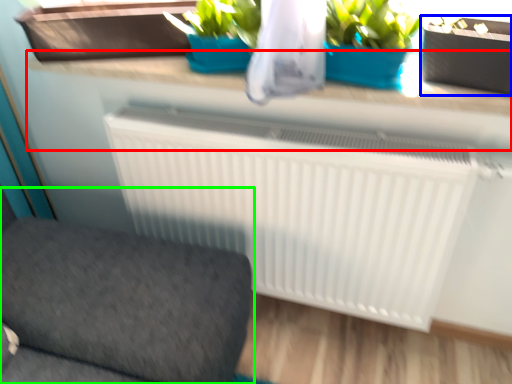
Question: Estimate the real-world distances between objects in this image. Which object is closer to counter top (highlighted by a red box), flowerpot (highlighted by a blue box) or furniture (highlighted by a green box)?

Choices:
 (A) flowerpot
 (B) furniture

Answer: (A)